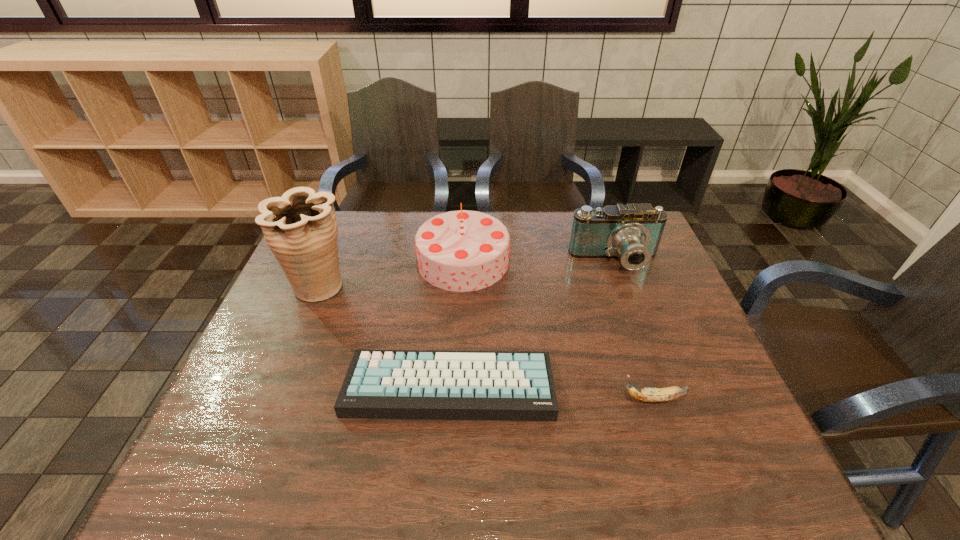
The height and width of the screenshot is (540, 960). I want to click on the leftmost object, so click(x=300, y=228).

What are the coordinates of `the tallest object` in the screenshot? It's located at (300, 228).

Where is `birthday cake`? The width and height of the screenshot is (960, 540). birthday cake is located at coordinates (463, 250).

Image resolution: width=960 pixels, height=540 pixels. Find the location of `camcorder`. camcorder is located at coordinates (632, 232).

This screenshot has width=960, height=540. Find the location of `the second shortest object`. the second shortest object is located at coordinates (673, 392).

Locate an element on the screen. The image size is (960, 540). the shortest object is located at coordinates (380, 384).

You are a GUI agent. You are given a task and a screenshot of the screen. Output one action in this format:
    pyautogui.click(x=<x>, y=<y>)
    Task: Click on the free space located 0.210m on the right of the leftmost object
    This screenshot has height=540, width=960.
    Given the screenshot: What is the action you would take?
    click(424, 285)

I want to click on vacant region located on the right of the second tallest object, so click(x=555, y=261).

Where is `vacant space located on the front-facing side of the camcorder`? This screenshot has width=960, height=540. vacant space located on the front-facing side of the camcorder is located at coordinates (649, 353).

In order to click on blank area located 0.280m at the stem of the second shortest object in this screenshot , I will do `click(497, 399)`.